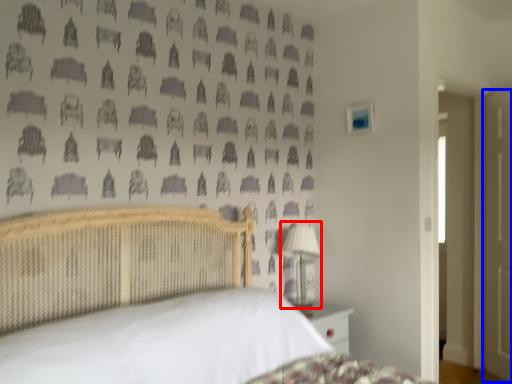
Question: Among these objects, which one is nearest to the camera, table lamp (highlighted by a red box) or door (highlighted by a blue box)?

Choices:
 (A) table lamp
 (B) door

Answer: (A)